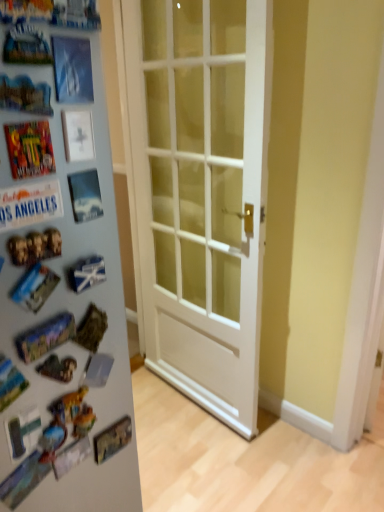
Question: From a real-world perspective, is white glossy door at center physically above shiny metallic comic book at left?

Choices:
 (A) yes
 (B) no

Answer: (B)

Question: Does white glossy door at center have a larger size compared to shiny metallic comic book at left?

Choices:
 (A) yes
 (B) no

Answer: (A)

Question: Considering the relative positions of white glossy door at center and shiny metallic comic book at left in the image provided, is white glossy door at center behind shiny metallic comic book at left?

Choices:
 (A) no
 (B) yes

Answer: (B)

Question: Is shiny metallic comic book at left inside white glossy door at center?

Choices:
 (A) yes
 (B) no

Answer: (B)

Question: Considering the relative positions of white glossy door at center and shiny metallic comic book at left in the image provided, is white glossy door at center to the right of shiny metallic comic book at left from the viewer's perspective?

Choices:
 (A) no
 (B) yes

Answer: (B)

Question: From the image's perspective, is white glossy door at center located above or below white glossy refrigerator at left?

Choices:
 (A) below
 (B) above

Answer: (A)

Question: Is white glossy door at center to the left or to the right of white glossy refrigerator at left in the image?

Choices:
 (A) left
 (B) right

Answer: (B)

Question: Considering their positions, is white glossy door at center located in front of or behind white glossy refrigerator at left?

Choices:
 (A) behind
 (B) front

Answer: (A)

Question: Is point (241, 346) positioned closer to the camera than point (56, 333)?

Choices:
 (A) farther
 (B) closer

Answer: (A)

Question: In the image, is white glossy refrigerator at left on the left side or the right side of shiny metallic comic book at left?

Choices:
 (A) left
 (B) right

Answer: (A)

Question: From a real-world perspective, is white glossy refrigerator at left physically located above or below shiny metallic comic book at left?

Choices:
 (A) below
 (B) above

Answer: (A)

Question: Considering their positions, is white glossy refrigerator at left located in front of or behind shiny metallic comic book at left?

Choices:
 (A) front
 (B) behind

Answer: (B)

Question: From the image's perspective, is white glossy refrigerator at left positioned above or below shiny metallic comic book at left?

Choices:
 (A) below
 (B) above

Answer: (A)

Question: In the image, is shiny metallic comic book at left on the left side or the right side of white glossy refrigerator at left?

Choices:
 (A) left
 (B) right

Answer: (B)

Question: From a real-world perspective, is shiny metallic comic book at left above or below white glossy refrigerator at left?

Choices:
 (A) below
 (B) above

Answer: (B)